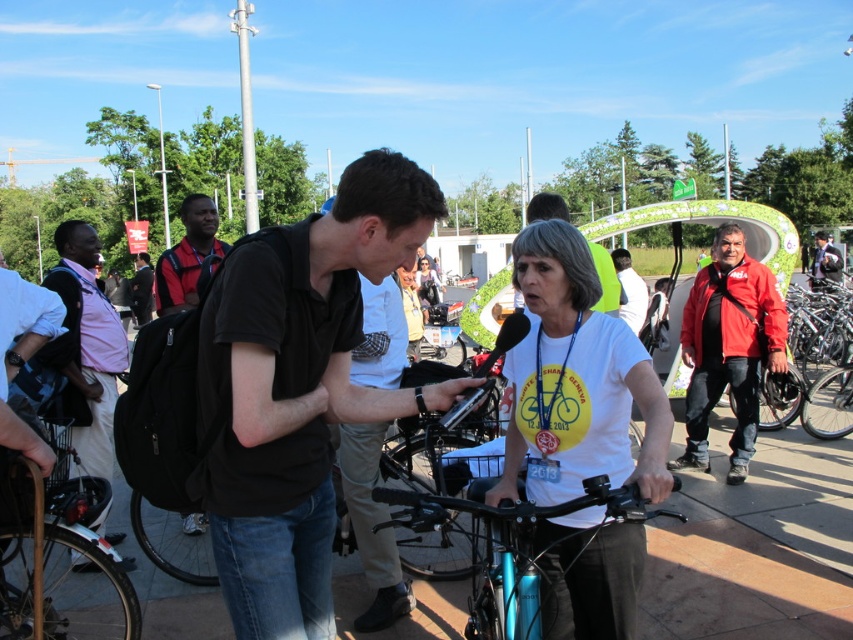
Who is higher up, pink shirt at left or black backpack at left?

black backpack at left is above.

Does pink shirt at left lie in front of black backpack at left?

That is True.

Identify the location of pink shirt at left. This screenshot has height=640, width=853. (86, 348).

Where is `pink shirt at left`? pink shirt at left is located at coordinates (86, 348).

Which is more to the right, black cotton shirt at center or black backpack at left?

Positioned to the right is black cotton shirt at center.

Consider the image. Between black cotton shirt at center and black backpack at left, which one is positioned higher?

black backpack at left is above.

Who is more forward, (384, 532) or (177, 305)?

Point (384, 532) is more forward.

Where is `black cotton shirt at center`? The image size is (853, 640). black cotton shirt at center is located at coordinates (370, 524).

Is point (331, 403) farther from viewer compared to point (73, 321)?

No.

Who is higher up, black matte shirt at center or pink shirt at left?

black matte shirt at center is higher up.

Describe the element at coordinates (300, 388) in the screenshot. The width and height of the screenshot is (853, 640). I see `black matte shirt at center` at that location.

Where is `black matte shirt at center`? black matte shirt at center is located at coordinates (300, 388).